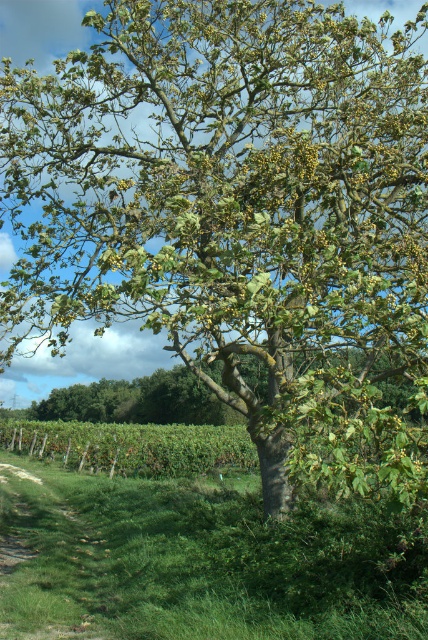
Can you confirm if grassy dirt path at lower left is positioned to the right of green leafy tree at center?

Answer: Incorrect, grassy dirt path at lower left is not on the right side of green leafy tree at center.

Who is more distant from viewer, (6, 497) or (395, 397)?

Positioned behind is point (395, 397).

At what (x,y) coordinates should I click in order to perform the action: click on grassy dirt path at lower left. Please return your answer as a coordinate pair (x, y). Looking at the image, I should click on (47, 557).

Find the location of a particular element. grassy dirt path at lower left is located at coordinates (47, 557).